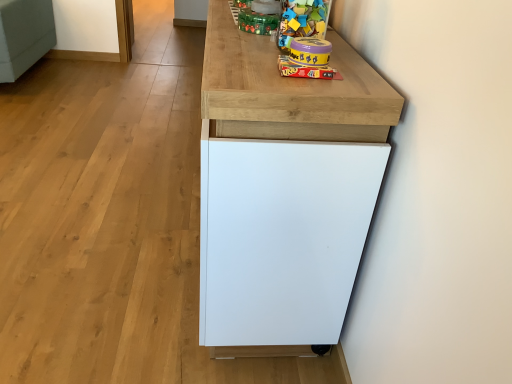
Question: Is white matte cabinet at center inside or outside of matte green plastic toy at upper center, positioned as the 3th toy in front-to-back order?

Choices:
 (A) outside
 (B) inside

Answer: (A)

Question: In terms of width, does white matte cabinet at center look wider or thinner when compared to matte green plastic toy at upper center, positioned as the 3th toy in front-to-back order?

Choices:
 (A) thin
 (B) wide

Answer: (B)

Question: Which of these objects is positioned closest to the matte green plastic toy at upper center, the 3th toy when ordered from bottom to top?

Choices:
 (A) white matte cabinet at center
 (B) matte yellow plastic uno game at upper center, which appears as the 2th toy when viewed from the back
 (C) purple plastic container at upper center, which is the second toy in top-to-bottom order

Answer: (C)

Question: Which object is positioned closest to the purple plastic container at upper center, which is the 2th toy from bottom to top?

Choices:
 (A) matte yellow plastic uno game at upper center, which appears as the 2th toy when viewed from the back
 (B) matte green plastic toy at upper center, the 1th toy when ordered from top to bottom
 (C) white matte cabinet at center

Answer: (A)